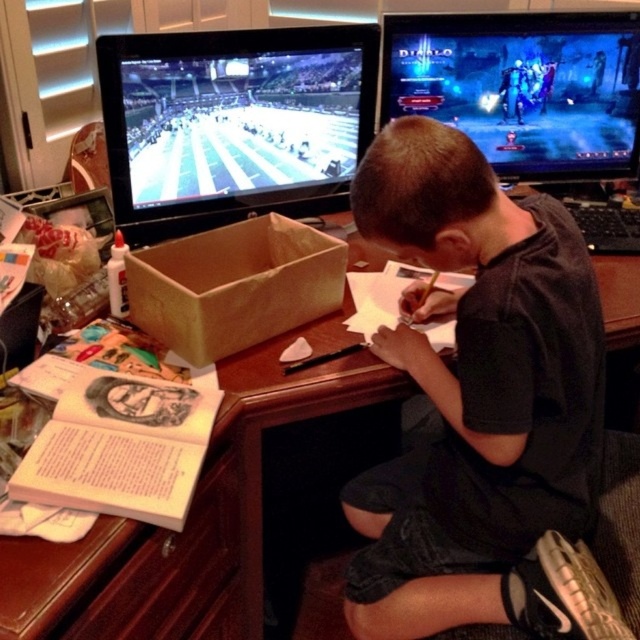
You are trying to locate the shiny plastic screen at upper left in the image. What are the coordinates of its position?

The coordinates of the shiny plastic screen at upper left are at point (234,124).

You are a tailor who needs to adjust the size of the black cotton shirt at center to match the width of the wooden at center. Based on the scene, what adjustment should you make to the shirt?

The black cotton shirt at center has a lesser width compared to wooden at center, so you should widen the shirt to match the width of the wooden at center.

You are standing in front of the desk and want to place a small sticker on the desk. You have two points to choose from, point A at coordinates point (x=467, y=401) and point B at coordinates point (x=148, y=570). If you want to place the sticker behind the boy, which point should you choose?

Point A at coordinates point (x=467, y=401) is behind point B at coordinates point (x=148, y=570), so placing the sticker at point A would position it behind the boy.